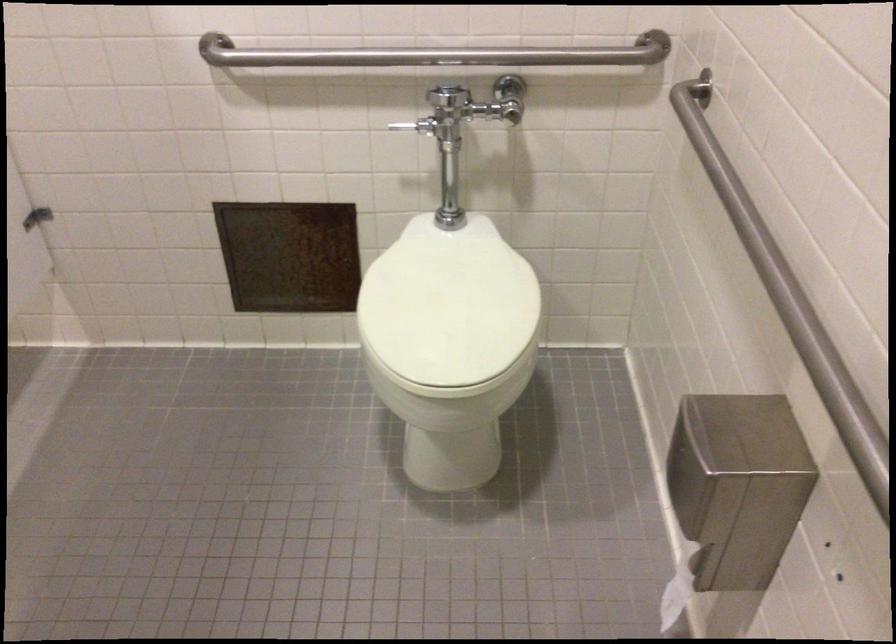
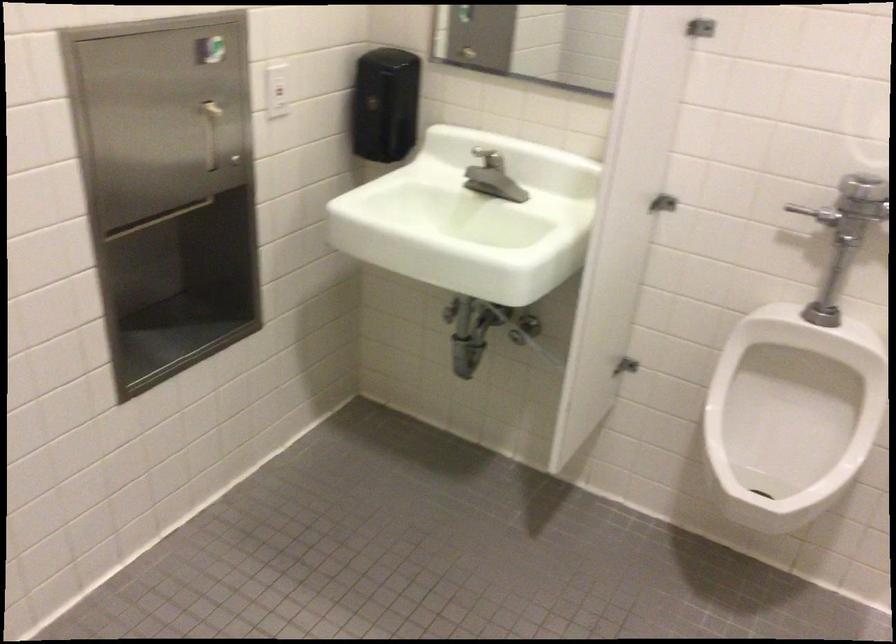
Question: The images are taken continuously from a first-person perspective. In which direction are you moving?

Choices:
 (A) Left
 (B) Right
 (C) Forward
 (D) Backward

Answer: (A)